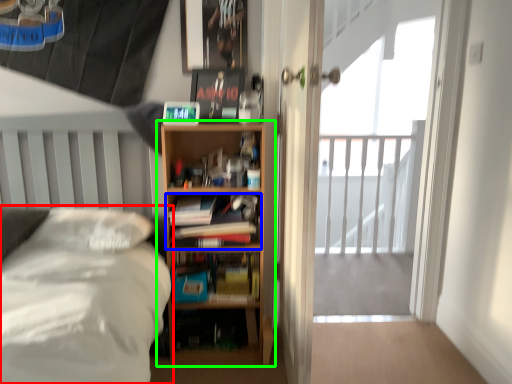
Question: Estimate the real-world distances between objects in this image. Which object is farther from bed (highlighted by a red box), book (highlighted by a blue box) or bookcase (highlighted by a green box)?

Choices:
 (A) book
 (B) bookcase

Answer: (B)